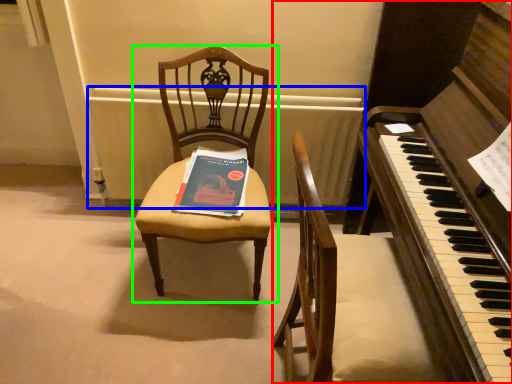
Question: Based on their relative distances, which object is farther from harpsichord (highlighted by a red box)? Choose from radiator (highlighted by a blue box) and chair (highlighted by a green box).

Choices:
 (A) radiator
 (B) chair

Answer: (A)